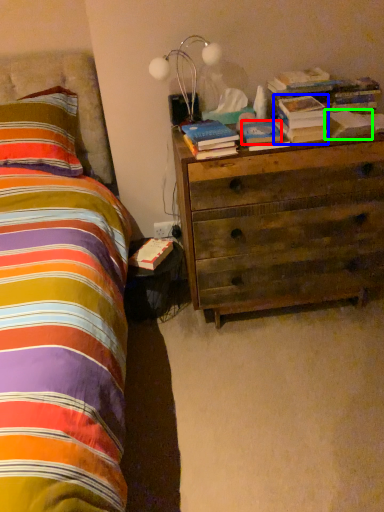
Question: Based on their relative distances, which object is nearer to paperback book (highlighted by a red box)? Choose from book (highlighted by a blue box) and paperback book (highlighted by a green box).

Choices:
 (A) book
 (B) paperback book

Answer: (A)